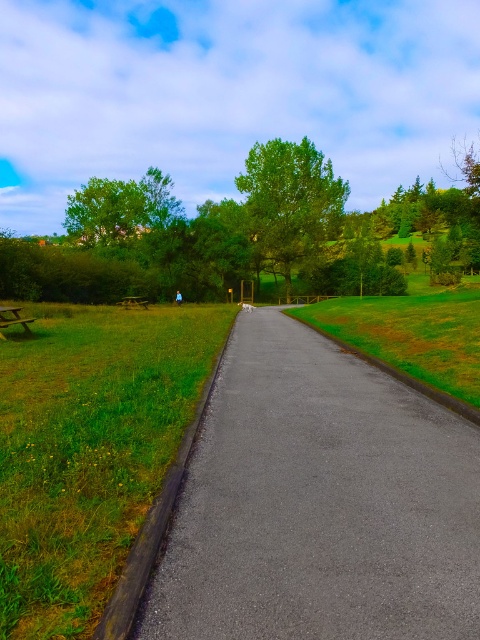
Does point (109, 449) come in front of point (144, 301)?

Yes, point (109, 449) is closer to viewer.

What do you see at coordinates (88, 449) in the screenshot? The image size is (480, 640). I see `green grassy at center` at bounding box center [88, 449].

Where is `green grassy at center`? green grassy at center is located at coordinates (88, 449).

Can you confirm if green leafy tree at upper left is positioned to the left of green leafy tree at center?

Incorrect, green leafy tree at upper left is not on the left side of green leafy tree at center.

Does green leafy tree at upper left come behind green leafy tree at center?

No, green leafy tree at upper left is in front of green leafy tree at center.

Is point (268, 264) positioned in front of point (273, 262)?

No, it is behind (273, 262).

Locate an element on the screen. The height and width of the screenshot is (640, 480). green leafy tree at upper left is located at coordinates click(x=235, y=234).

Between green leafy tree at center and wooden picnic table at center, which one is positioned lower?

Positioned lower is wooden picnic table at center.

Which is above, green leafy tree at center or wooden picnic table at center?

green leafy tree at center

The image size is (480, 640). In order to click on green leafy tree at center in this screenshot , I will do `click(290, 202)`.

Locate an element on the screen. green leafy tree at center is located at coordinates tap(290, 202).